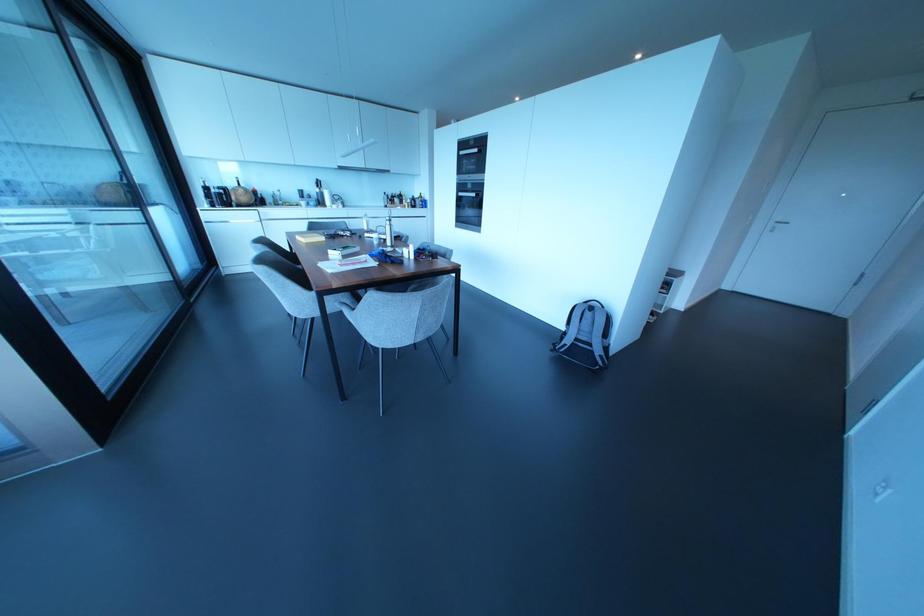
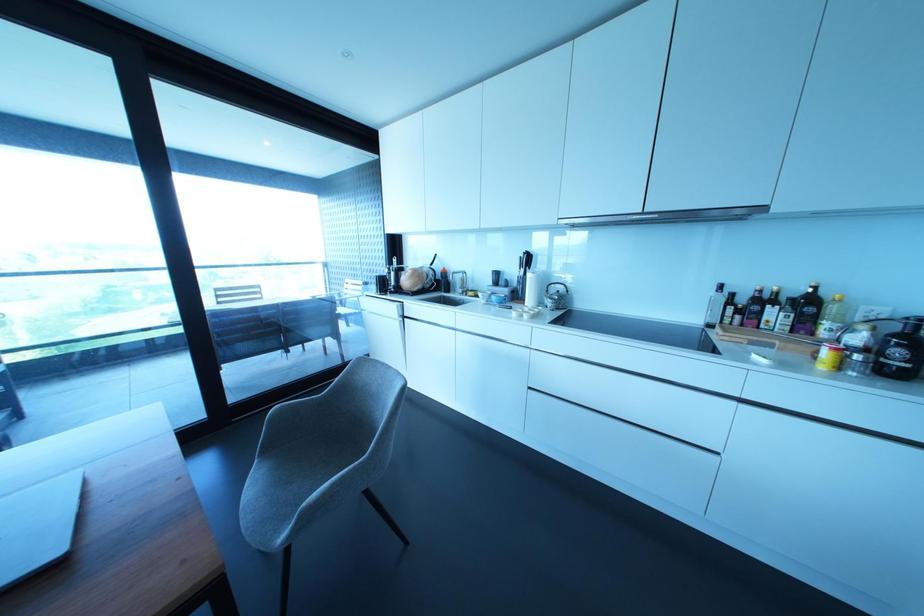
In the second image, find the point that corresponds to [399,196] in the first image.

(807, 304)